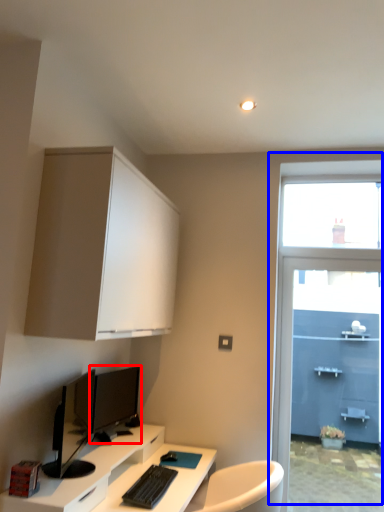
Question: Which object appears farthest to the camera in this image, computer monitor (highlighted by a red box) or window (highlighted by a blue box)?

Choices:
 (A) computer monitor
 (B) window

Answer: (B)